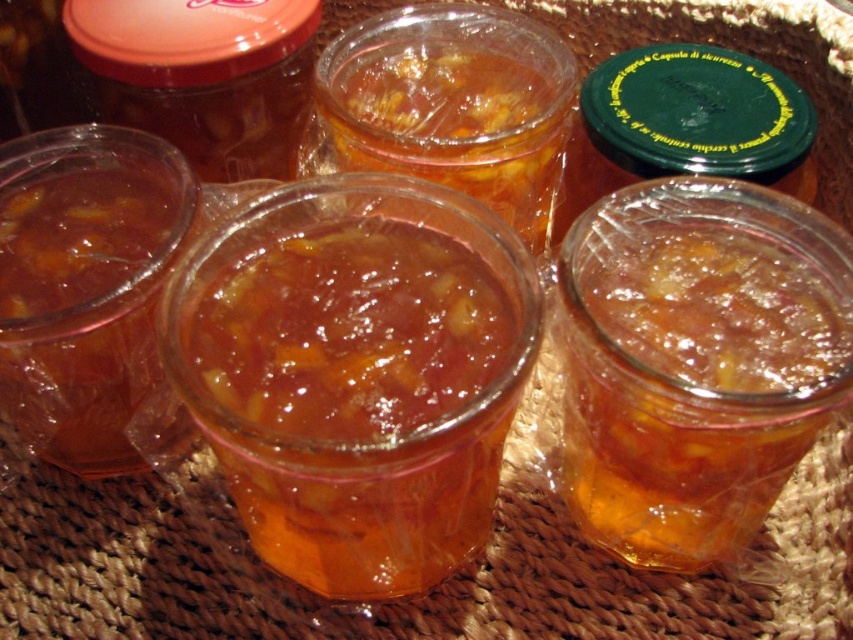
Question: Is translucent glass jam at center behind translucent amber jam at center?

Choices:
 (A) yes
 (B) no

Answer: (B)

Question: Does translucent glass jam at center appear on the left side of translucent amber jam at center?

Choices:
 (A) yes
 (B) no

Answer: (A)

Question: Where is translucent glass jam at center located in relation to translucent amber jam at center in the image?

Choices:
 (A) left
 (B) right

Answer: (A)